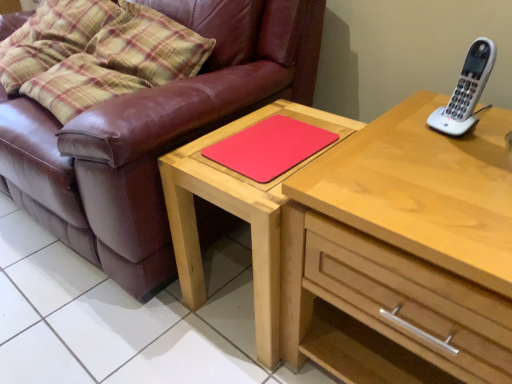
The width and height of the screenshot is (512, 384). In order to click on empty space that is to the right of white plastic phone at upper right in this screenshot , I will do `click(493, 124)`.